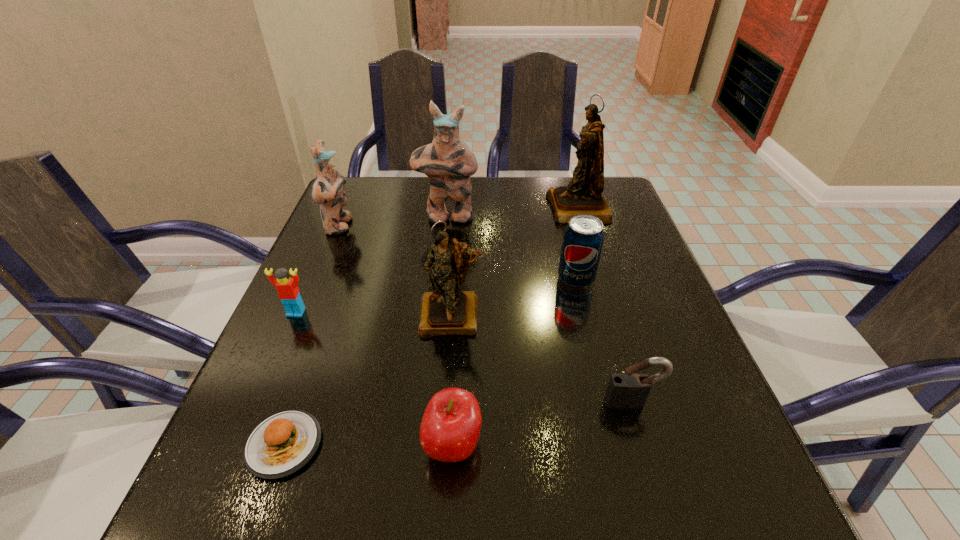
The height and width of the screenshot is (540, 960). I want to click on free space located 0.200m on the face of the Lego, so pos(256,403).

The image size is (960, 540). Find the location of `vacant space located on the back of the apple`. vacant space located on the back of the apple is located at coordinates (458, 334).

Find the location of a particular element. This screenshot has width=960, height=540. vacant area situated with the keyhole on the front of the seventh farthest object is located at coordinates (656, 481).

Locate an element on the screen. This screenshot has width=960, height=540. vacant region located on the right of the food is located at coordinates (533, 445).

Where is `apple that is at the near edge`? apple that is at the near edge is located at coordinates (451, 424).

This screenshot has height=540, width=960. What are the coordinates of `food at the near edge` in the screenshot? It's located at [283, 443].

You are a GUI agent. You are given a task and a screenshot of the screen. Output one action in this format:
    pyautogui.click(x=<x>, y=<y>)
    Task: Click on the figurine that is at the left edge
    This screenshot has width=960, height=540.
    Given the screenshot: What is the action you would take?
    pyautogui.click(x=327, y=191)

Find the location of a particular element. The image size is (960, 540). Lego present at the left edge is located at coordinates (287, 288).

I want to click on food positioned at the left edge, so click(x=283, y=443).

Where is `figurine that is at the right edge`? figurine that is at the right edge is located at coordinates (583, 195).